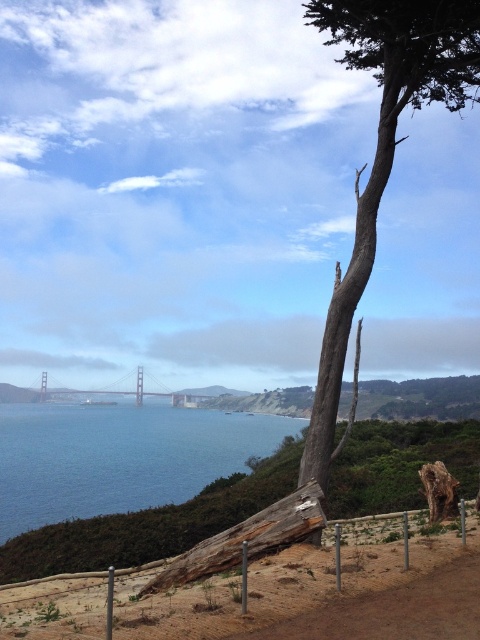
Question: Among these objects, which one is farthest from the camera?

Choices:
 (A) metallic bridge at center
 (B) blue water at center
 (C) brown wooden fence at lower center
 (D) smooth gray bark tree at upper right

Answer: (A)

Question: Can you confirm if brown wooden fence at lower center is positioned below metallic bridge at center?

Choices:
 (A) no
 (B) yes

Answer: (A)

Question: Which point is farther to the camera?

Choices:
 (A) (450, 38)
 (B) (139, 480)
 (C) (175, 588)
 (D) (136, 381)

Answer: (D)

Question: Does blue water at center have a greater width compared to smooth gray bark tree at upper right?

Choices:
 (A) yes
 (B) no

Answer: (A)

Question: Observing the image, what is the correct spatial positioning of blue water at center in reference to metallic bridge at center?

Choices:
 (A) left
 (B) right

Answer: (B)

Question: Which object is closer to the camera taking this photo?

Choices:
 (A) brown wooden fence at lower center
 (B) smooth gray bark tree at upper right

Answer: (B)